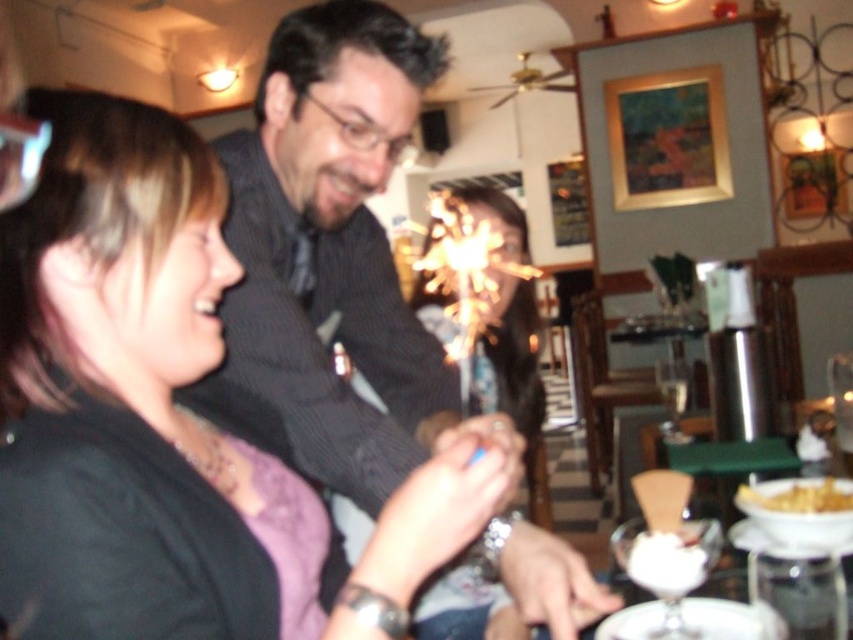
Question: Can you confirm if matte black shirt at center is positioned to the left of white creamy dessert at lower right?

Choices:
 (A) no
 (B) yes

Answer: (B)

Question: Considering the real-world distances, which object is closest to the clear glass wine glass at right?

Choices:
 (A) matte black shirt at center
 (B) shiny black shirt at center
 (C) white frosted glass at lower right
 (D) white creamy dessert at lower right

Answer: (D)

Question: Which object is the farthest from the white creamy dessert at lower right?

Choices:
 (A) clear glass wine glass at right
 (B) white frosted glass at lower right
 (C) white creamy dessert at lower center

Answer: (A)

Question: Is matte black shirt at center smaller than white frosted glass at lower right?

Choices:
 (A) no
 (B) yes

Answer: (A)

Question: Which point is farther to the camera?

Choices:
 (A) clear glass wine glass at right
 (B) white frosted glass at lower right

Answer: (A)

Question: Can you confirm if matte black shirt at center is bigger than white creamy dessert at lower right?

Choices:
 (A) no
 (B) yes

Answer: (B)